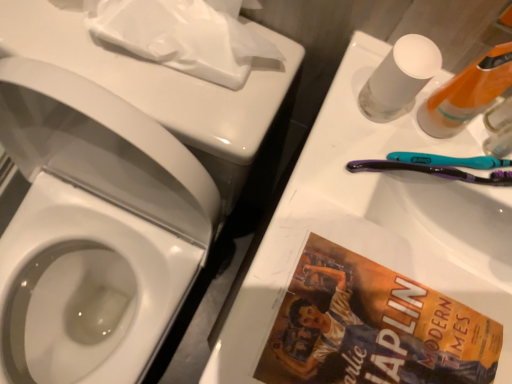
I want to click on free space in front of translucent plastic bottle at upper right, placed as the second mouthwash when sorted from left to right, so click(401, 268).